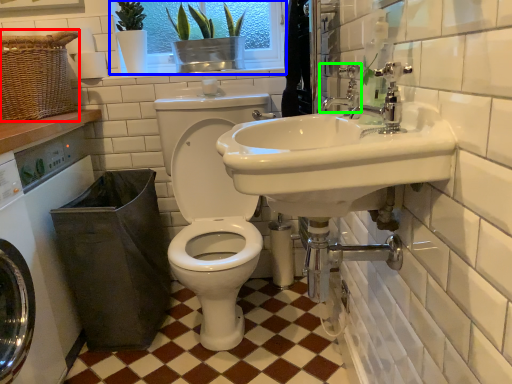
Question: Which is farther away from basket (highlighted by a red box)? window screen (highlighted by a blue box) or tap (highlighted by a green box)?

Choices:
 (A) window screen
 (B) tap

Answer: (B)